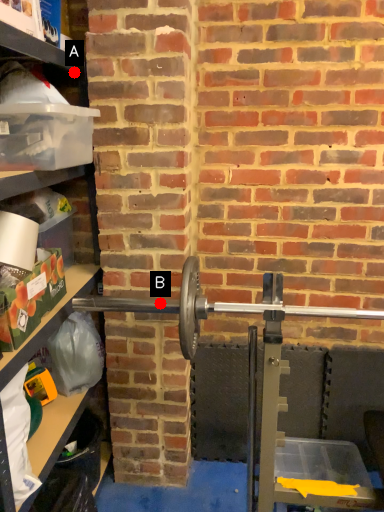
Question: Two points are circled on the image, labeled by A and B beside each circle. Which point is closer to the camera taking this photo?

Choices:
 (A) A is closer
 (B) B is closer

Answer: (B)